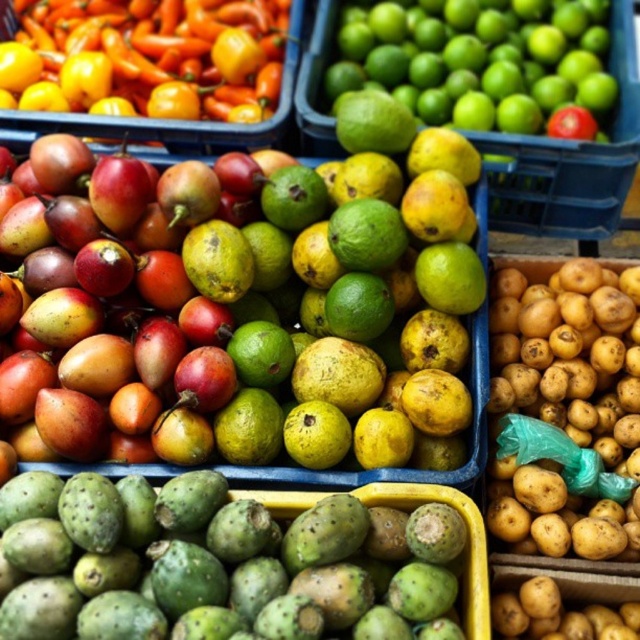
Does green matte limes at upper right lie in front of red matte tomato at upper right?

That is True.

Does green matte limes at upper right appear on the right side of red matte tomato at upper right?

Indeed, green matte limes at upper right is positioned on the right side of red matte tomato at upper right.

Is point (600, 228) closer to camera compared to point (552, 112)?

No, it is behind (552, 112).

Locate an element on the screen. Image resolution: width=640 pixels, height=640 pixels. green matte limes at upper right is located at coordinates (570, 161).

Describe the element at coordinates (147, 54) in the screenshot. I see `smooth orange peppers at upper left` at that location.

Which is in front, point (118, 12) or point (550, 214)?

Point (550, 214) is in front.

Locate an element on the screen. smooth orange peppers at upper left is located at coordinates (147, 54).

Does green matte lime at upper right have a smaller size compared to green matte limes at upper right?

Indeed, green matte lime at upper right has a smaller size compared to green matte limes at upper right.

Does green matte lime at upper right have a greater height compared to green matte limes at upper right?

In fact, green matte lime at upper right may be shorter than green matte limes at upper right.

Describe the element at coordinates (477, 58) in the screenshot. I see `green matte lime at upper right` at that location.

Find the location of a particular element. This screenshot has width=640, height=640. green matte lime at upper right is located at coordinates (477, 58).